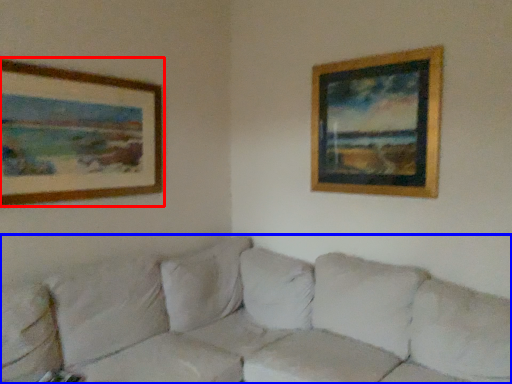
Question: Among these objects, which one is nearest to the camera, picture frame (highlighted by a red box) or studio couch (highlighted by a blue box)?

Choices:
 (A) picture frame
 (B) studio couch

Answer: (B)